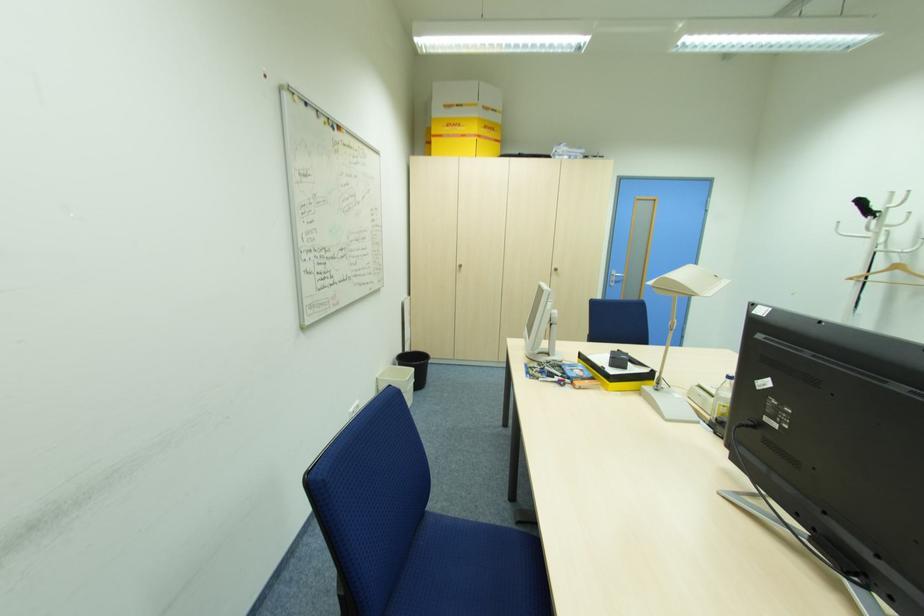
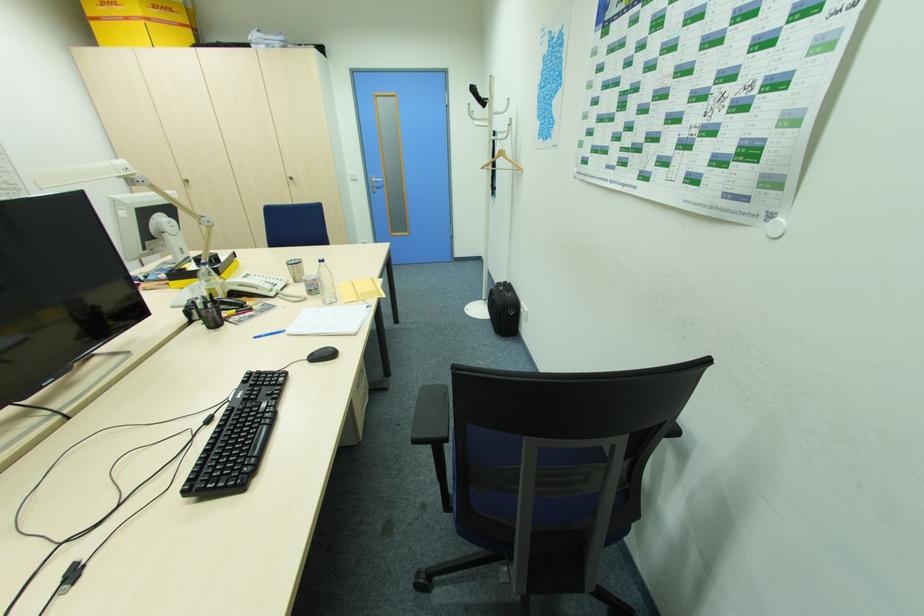
Question: What movement of the cameraman would produce the second image?

Choices:
 (A) Left
 (B) Right
 (C) Forward
 (D) Backward

Answer: (B)